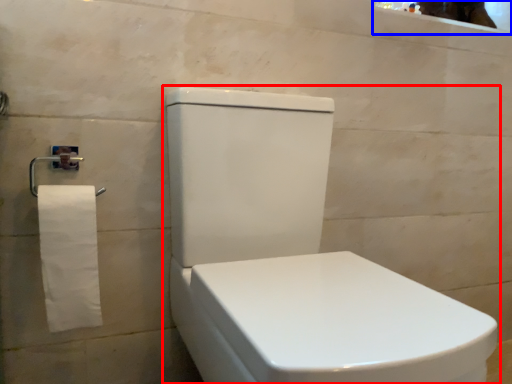
Question: Which of the following is the farthest to the observer, toilet (highlighted by a red box) or mirror (highlighted by a blue box)?

Choices:
 (A) toilet
 (B) mirror

Answer: (B)